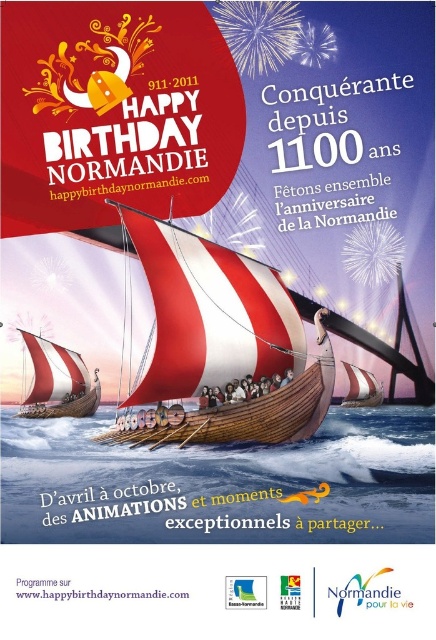
This screenshot has height=640, width=436. What do you see at coordinates (220, 342) in the screenshot? I see `wooden viking ship at center` at bounding box center [220, 342].

Can you confirm if wooden viking ship at center is shorter than white striped sailboat at center?

In fact, wooden viking ship at center may be taller than white striped sailboat at center.

Where is `wooden viking ship at center`? This screenshot has height=640, width=436. wooden viking ship at center is located at coordinates (220, 342).

Who is higher up, white striped sailboat at center or red and white striped sailboat at center?

red and white striped sailboat at center

Measure the distance between white striped sailboat at center and camera.

The distance of white striped sailboat at center from camera is 90.68 meters.

Does point (41, 353) come behind point (356, 392)?

Yes.

Locate an element on the screen. white striped sailboat at center is located at coordinates (57, 381).

Which is more to the right, wooden viking ship at center or red and white striped sailboat at center?

red and white striped sailboat at center is more to the right.

Can you confirm if wooden viking ship at center is positioned to the left of red and white striped sailboat at center?

Yes, wooden viking ship at center is to the left of red and white striped sailboat at center.

Does point (204, 307) come closer to viewer compared to point (344, 364)?

Yes, it is in front of point (344, 364).

Where is `wooden viking ship at center`? wooden viking ship at center is located at coordinates (220, 342).